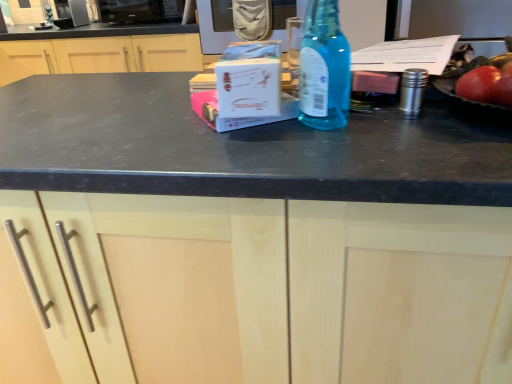
Question: Does point (78, 26) appear closer or farther from the camera than point (68, 39)?

Choices:
 (A) farther
 (B) closer

Answer: (A)

Question: Considering the positions of satin silver microwave at upper left, the 2th appliance when ordered from right to left, and matte wood cabinet at center, acting as the first cabinetry starting from the back, in the image, is satin silver microwave at upper left, the 2th appliance when ordered from right to left, wider or thinner than matte wood cabinet at center, acting as the first cabinetry starting from the back,?

Choices:
 (A) wide
 (B) thin

Answer: (B)

Question: Considering the real-world distances, which object is farthest from the satin silver microwave at upper left, the 1th appliance viewed from the left?

Choices:
 (A) matte wood cabinet at center, which is the 1th cabinetry in front-to-back order
 (B) blue glass bottle at center
 (C) matte wood cabinet at center, which appears as the second cabinetry when ordered from the bottom
 (D) black matte microwave at upper center, which ranks as the 2th appliance in left-to-right order

Answer: (A)

Question: Estimate the real-world distances between objects in this image. Which object is closer to the matte wood cabinet at center, acting as the second cabinetry starting from the front?

Choices:
 (A) black matte microwave at upper center, which ranks as the 2th appliance in left-to-right order
 (B) matte wood cabinet at center, the first cabinetry from the bottom
 (C) blue glass bottle at center
 (D) satin silver microwave at upper left, the 2th appliance when ordered from right to left

Answer: (A)